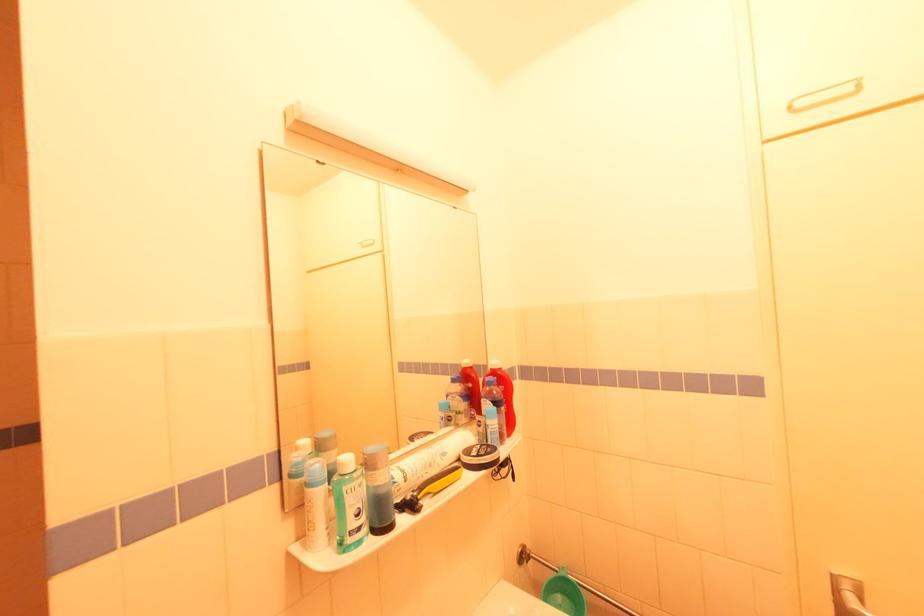
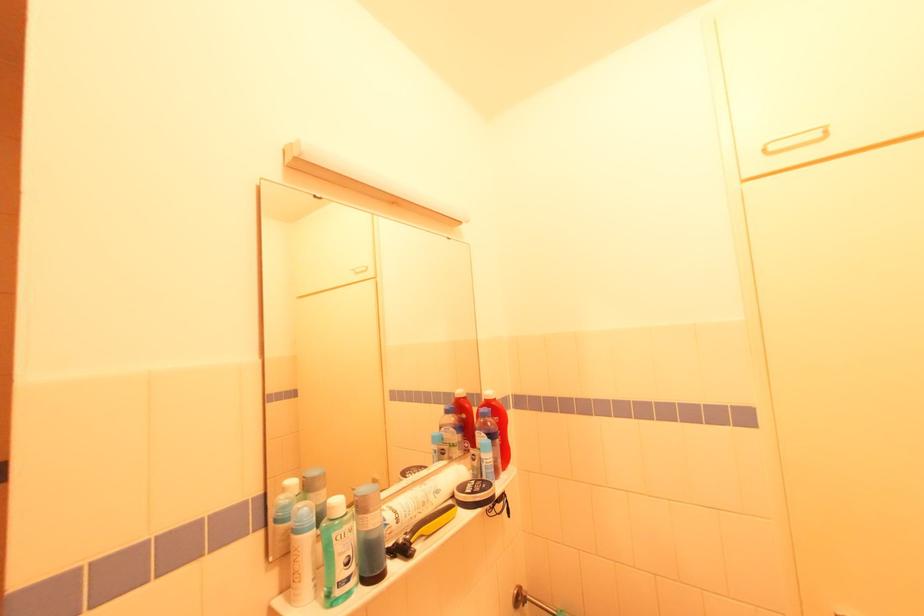
Find the pixel in the second image that matches point 488,455 in the first image.

(482, 492)